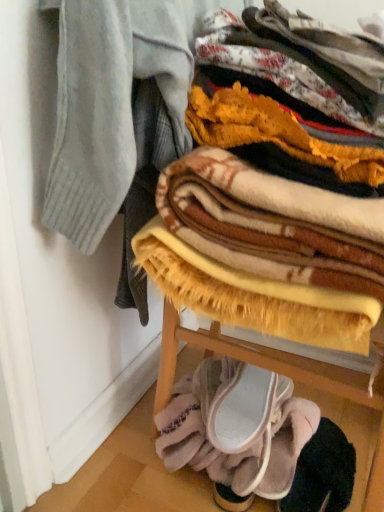
What do you see at coordinates (288, 446) in the screenshot? I see `pink suede sneakers at lower center, placed as the 1th footwear when sorted from bottom to top` at bounding box center [288, 446].

What do you see at coordinates (237, 428) in the screenshot? The width and height of the screenshot is (384, 512). I see `soft yellow blanket at lower center, acting as the 1th blanket starting from the bottom` at bounding box center [237, 428].

What do you see at coordinates (238, 402) in the screenshot? Image resolution: width=384 pixels, height=512 pixels. I see `pink suede slipper at lower center, placed as the 2th footwear when sorted from bottom to top` at bounding box center [238, 402].

Where is `light gray ribbed sweater at upper left`? The width and height of the screenshot is (384, 512). light gray ribbed sweater at upper left is located at coordinates (116, 104).

Where is `pink suede sneakers at lower center, the second footwear from the top`? Image resolution: width=384 pixels, height=512 pixels. pink suede sneakers at lower center, the second footwear from the top is located at coordinates (288, 446).

Considering the sizes of plush yellow blanket at center, acting as the first blanket starting from the top, and light gray ribbed sweater at upper left in the image, is plush yellow blanket at center, acting as the first blanket starting from the top, wider or thinner than light gray ribbed sweater at upper left?

Clearly, plush yellow blanket at center, acting as the first blanket starting from the top, has more width compared to light gray ribbed sweater at upper left.

Is plush yellow blanket at center, acting as the first blanket starting from the top, positioned before light gray ribbed sweater at upper left?

Yes.

Between plush yellow blanket at center, acting as the first blanket starting from the top, and light gray ribbed sweater at upper left, which one appears on the left side from the viewer's perspective?

Positioned to the left is light gray ribbed sweater at upper left.

Considering the sizes of objects plush yellow blanket at center, acting as the first blanket starting from the top, and light gray ribbed sweater at upper left in the image provided, who is bigger, plush yellow blanket at center, acting as the first blanket starting from the top, or light gray ribbed sweater at upper left?

plush yellow blanket at center, acting as the first blanket starting from the top, is bigger.

Does soft yellow blanket at lower center, acting as the 1th blanket starting from the bottom, have a larger size compared to pink suede slipper at lower center, which appears as the 1th footwear when viewed from the top?

Correct, soft yellow blanket at lower center, acting as the 1th blanket starting from the bottom, is larger in size than pink suede slipper at lower center, which appears as the 1th footwear when viewed from the top.

Can you tell me how much soft yellow blanket at lower center, acting as the 1th blanket starting from the bottom, and pink suede slipper at lower center, which appears as the 1th footwear when viewed from the top, differ in facing direction?

1.36e-05 degrees separate the facing orientations of soft yellow blanket at lower center, acting as the 1th blanket starting from the bottom, and pink suede slipper at lower center, which appears as the 1th footwear when viewed from the top.

Is point (207, 370) more distant than point (211, 376)?

Yes, point (207, 370) is behind point (211, 376).

Is soft yellow blanket at lower center, the second blanket when ordered from top to bottom, aimed at pink suede slipper at lower center, placed as the 2th footwear when sorted from bottom to top?

No, soft yellow blanket at lower center, the second blanket when ordered from top to bottom, is not facing towards pink suede slipper at lower center, placed as the 2th footwear when sorted from bottom to top.

Is pink suede sneakers at lower center, placed as the 1th footwear when sorted from bottom to top, directly adjacent to pink suede slipper at lower center, placed as the 2th footwear when sorted from bottom to top?

Indeed, pink suede sneakers at lower center, placed as the 1th footwear when sorted from bottom to top, and pink suede slipper at lower center, placed as the 2th footwear when sorted from bottom to top, are beside each other and touching.

What's the angular difference between pink suede sneakers at lower center, the second footwear from the top, and pink suede slipper at lower center, which appears as the 1th footwear when viewed from the top,'s facing directions?

The angular difference between pink suede sneakers at lower center, the second footwear from the top, and pink suede slipper at lower center, which appears as the 1th footwear when viewed from the top, is 0.58 degrees.

Is pink suede sneakers at lower center, placed as the 1th footwear when sorted from bottom to top, positioned beyond the bounds of pink suede slipper at lower center, which appears as the 1th footwear when viewed from the top?

Absolutely, pink suede sneakers at lower center, placed as the 1th footwear when sorted from bottom to top, is external to pink suede slipper at lower center, which appears as the 1th footwear when viewed from the top.

Is pink suede sneakers at lower center, placed as the 1th footwear when sorted from bottom to top, positioned with its back to pink suede slipper at lower center, which appears as the 1th footwear when viewed from the top?

That's not correct — pink suede sneakers at lower center, placed as the 1th footwear when sorted from bottom to top, is not looking away from pink suede slipper at lower center, which appears as the 1th footwear when viewed from the top.

Is pink suede slipper at lower center, which appears as the 1th footwear when viewed from the top, far away from plush yellow blanket at center, the 2th blanket ordered from the bottom?

No.

The image size is (384, 512). Identify the location of blanket that appears above the pink suede slipper at lower center, which appears as the 1th footwear when viewed from the top (from a real-world perspective). (275, 221).

Is plush yellow blanket at center, acting as the first blanket starting from the top, surrounded by pink suede slipper at lower center, placed as the 2th footwear when sorted from bottom to top?

That's incorrect, plush yellow blanket at center, acting as the first blanket starting from the top, is not inside pink suede slipper at lower center, placed as the 2th footwear when sorted from bottom to top.

Considering the relative positions of pink suede slipper at lower center, which appears as the 1th footwear when viewed from the top, and soft yellow blanket at lower center, acting as the 1th blanket starting from the bottom, in the image provided, is pink suede slipper at lower center, which appears as the 1th footwear when viewed from the top, to the left or to the right of soft yellow blanket at lower center, acting as the 1th blanket starting from the bottom,?

pink suede slipper at lower center, which appears as the 1th footwear when viewed from the top, is positioned on soft yellow blanket at lower center, acting as the 1th blanket starting from the bottom,'s right side.

Is pink suede slipper at lower center, placed as the 2th footwear when sorted from bottom to top, positioned far away from soft yellow blanket at lower center, the second blanket when ordered from top to bottom?

That's not correct — pink suede slipper at lower center, placed as the 2th footwear when sorted from bottom to top, is a little close to soft yellow blanket at lower center, the second blanket when ordered from top to bottom.

From the image's perspective, who appears lower, pink suede slipper at lower center, which appears as the 1th footwear when viewed from the top, or soft yellow blanket at lower center, acting as the 1th blanket starting from the bottom?

Answer: From the image's view, soft yellow blanket at lower center, acting as the 1th blanket starting from the bottom, is below.

Choose the correct answer: Is pink suede slipper at lower center, placed as the 2th footwear when sorted from bottom to top, inside soft yellow blanket at lower center, acting as the 1th blanket starting from the bottom, or outside it?

pink suede slipper at lower center, placed as the 2th footwear when sorted from bottom to top, cannot be found inside soft yellow blanket at lower center, acting as the 1th blanket starting from the bottom.

Considering their positions, is light gray ribbed sweater at upper left located in front of or behind pink suede sneakers at lower center, placed as the 1th footwear when sorted from bottom to top?

Visually, light gray ribbed sweater at upper left is located in front of pink suede sneakers at lower center, placed as the 1th footwear when sorted from bottom to top.

Which of these two, light gray ribbed sweater at upper left or pink suede sneakers at lower center, the second footwear from the top, stands taller?

With more height is light gray ribbed sweater at upper left.

From the image's perspective, who appears lower, light gray ribbed sweater at upper left or pink suede sneakers at lower center, the second footwear from the top?

pink suede sneakers at lower center, the second footwear from the top, from the image's perspective.

At what (x,y) coordinates should I click in order to perform the action: click on garment above the pink suede sneakers at lower center, placed as the 1th footwear when sorted from bottom to top (from the image's perspective). Please return your answer as a coordinate pair (x, y). The image size is (384, 512). Looking at the image, I should click on (116, 104).

Is light gray ribbed sweater at upper left outside of soft yellow blanket at lower center, the second blanket when ordered from top to bottom?

Yes, light gray ribbed sweater at upper left is not within soft yellow blanket at lower center, the second blanket when ordered from top to bottom.

Is light gray ribbed sweater at upper left shorter than soft yellow blanket at lower center, acting as the 1th blanket starting from the bottom?

In fact, light gray ribbed sweater at upper left may be taller than soft yellow blanket at lower center, acting as the 1th blanket starting from the bottom.

Could you measure the distance between light gray ribbed sweater at upper left and soft yellow blanket at lower center, the second blanket when ordered from top to bottom?

A distance of 20.14 inches exists between light gray ribbed sweater at upper left and soft yellow blanket at lower center, the second blanket when ordered from top to bottom.

From a real-world perspective, is light gray ribbed sweater at upper left positioned over soft yellow blanket at lower center, acting as the 1th blanket starting from the bottom, based on gravity?

Correct, in the physical world, light gray ribbed sweater at upper left is higher than soft yellow blanket at lower center, acting as the 1th blanket starting from the bottom.

What are the coordinates of `blanket that is the 1st one below the light gray ribbed sweater at upper left (from a real-world perspective)` in the screenshot? It's located at (275, 221).

Where is `footwear above the soft yellow blanket at lower center, acting as the 1th blanket starting from the bottom (from the image's perspective)`? The image size is (384, 512). footwear above the soft yellow blanket at lower center, acting as the 1th blanket starting from the bottom (from the image's perspective) is located at coordinates (238, 402).

Estimate the real-world distances between objects in this image. Which object is further from soft yellow blanket at lower center, acting as the 1th blanket starting from the bottom, light gray ribbed sweater at upper left or pink suede sneakers at lower center, the second footwear from the top?

Based on the image, light gray ribbed sweater at upper left appears to be further to soft yellow blanket at lower center, acting as the 1th blanket starting from the bottom.

Which object lies nearer to the anchor point soft yellow blanket at lower center, acting as the 1th blanket starting from the bottom, pink suede sneakers at lower center, the second footwear from the top, or plush yellow blanket at center, acting as the first blanket starting from the top?

pink suede sneakers at lower center, the second footwear from the top.

Looking at the image, which one is located further to plush yellow blanket at center, acting as the first blanket starting from the top, light gray ribbed sweater at upper left or pink suede sneakers at lower center, placed as the 1th footwear when sorted from bottom to top?

Among the two, pink suede sneakers at lower center, placed as the 1th footwear when sorted from bottom to top, is located further to plush yellow blanket at center, acting as the first blanket starting from the top.

Estimate the real-world distances between objects in this image. Which object is closer to soft yellow blanket at lower center, the second blanket when ordered from top to bottom, light gray ribbed sweater at upper left or pink suede slipper at lower center, placed as the 2th footwear when sorted from bottom to top?

pink suede slipper at lower center, placed as the 2th footwear when sorted from bottom to top, is closer to soft yellow blanket at lower center, the second blanket when ordered from top to bottom.

Based on their spatial positions, is light gray ribbed sweater at upper left or plush yellow blanket at center, acting as the first blanket starting from the top, further from pink suede sneakers at lower center, placed as the 1th footwear when sorted from bottom to top?

Based on the image, light gray ribbed sweater at upper left appears to be further to pink suede sneakers at lower center, placed as the 1th footwear when sorted from bottom to top.

From the image, which object appears to be nearer to soft yellow blanket at lower center, acting as the 1th blanket starting from the bottom, plush yellow blanket at center, acting as the first blanket starting from the top, or pink suede sneakers at lower center, placed as the 1th footwear when sorted from bottom to top?

pink suede sneakers at lower center, placed as the 1th footwear when sorted from bottom to top, is positioned closer to the anchor soft yellow blanket at lower center, acting as the 1th blanket starting from the bottom.

From the image, which object appears to be farther from plush yellow blanket at center, acting as the first blanket starting from the top, pink suede sneakers at lower center, placed as the 1th footwear when sorted from bottom to top, or light gray ribbed sweater at upper left?

pink suede sneakers at lower center, placed as the 1th footwear when sorted from bottom to top, is positioned further to the anchor plush yellow blanket at center, acting as the first blanket starting from the top.

When comparing their distances from plush yellow blanket at center, the 2th blanket ordered from the bottom, does pink suede slipper at lower center, placed as the 2th footwear when sorted from bottom to top, or light gray ribbed sweater at upper left seem further?

Among the two, pink suede slipper at lower center, placed as the 2th footwear when sorted from bottom to top, is located further to plush yellow blanket at center, the 2th blanket ordered from the bottom.

Where is `footwear that lies between plush yellow blanket at center, the 2th blanket ordered from the bottom, and pink suede sneakers at lower center, the second footwear from the top, from top to bottom`? footwear that lies between plush yellow blanket at center, the 2th blanket ordered from the bottom, and pink suede sneakers at lower center, the second footwear from the top, from top to bottom is located at coordinates pyautogui.click(x=238, y=402).

Find the location of a particular element. The image size is (384, 512). blanket between plush yellow blanket at center, the 2th blanket ordered from the bottom, and pink suede sneakers at lower center, placed as the 1th footwear when sorted from bottom to top, in the up-down direction is located at coordinates (237, 428).

You are a GUI agent. You are given a task and a screenshot of the screen. Output one action in this format:
    pyautogui.click(x=<x>, y=<y>)
    Task: Click on the footwear between plush yellow blanket at center, acting as the first blanket starting from the top, and soft yellow blanket at lower center, the second blanket when ordered from top to bottom, in the vertical direction
    This screenshot has width=384, height=512.
    Given the screenshot: What is the action you would take?
    pyautogui.click(x=238, y=402)

You are a GUI agent. You are given a task and a screenshot of the screen. Output one action in this format:
    pyautogui.click(x=<x>, y=<y>)
    Task: Click on the blanket between light gray ribbed sweater at upper left and soft yellow blanket at lower center, the second blanket when ordered from top to bottom, vertically
    
    Given the screenshot: What is the action you would take?
    pyautogui.click(x=275, y=221)